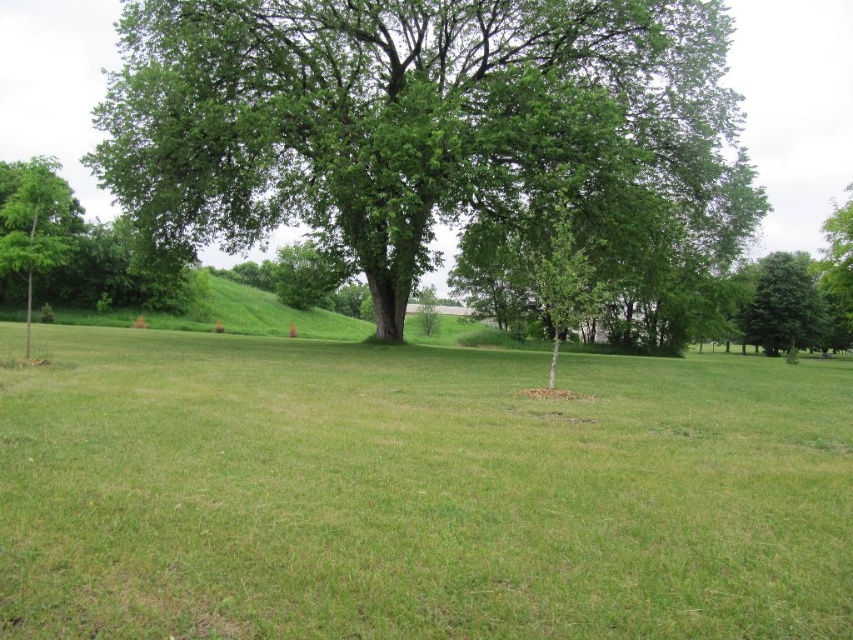
Question: Which object appears closest to the camera in this image?

Choices:
 (A) green leafy tree at left
 (B) green grassy field at center

Answer: (B)

Question: Does green leafy tree at center have a lesser width compared to green leafy tree at left?

Choices:
 (A) yes
 (B) no

Answer: (B)

Question: Is green leafy tree at center to the right of green leafy tree at right from the viewer's perspective?

Choices:
 (A) no
 (B) yes

Answer: (A)

Question: Which object appears farthest from the camera in this image?

Choices:
 (A) green grassy field at center
 (B) green leafy tree at left
 (C) green leafy tree at center
 (D) green leafy tree at right

Answer: (D)

Question: Which point is farther to the camera?

Choices:
 (A) green grassy field at center
 (B) green leafy tree at left

Answer: (B)

Question: Can you confirm if green leafy tree at center is wider than green leafy tree at right?

Choices:
 (A) no
 (B) yes

Answer: (B)